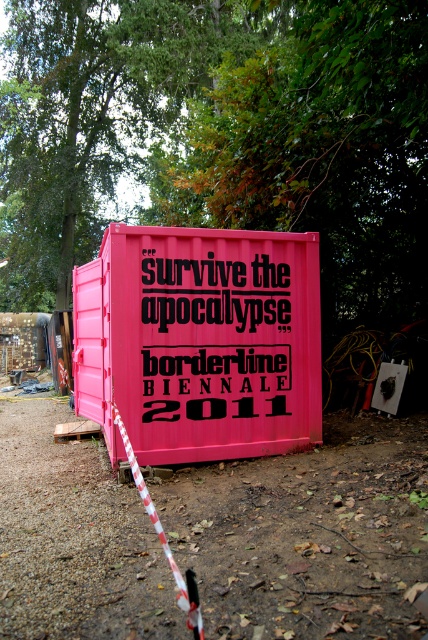
Question: Which point appears farthest from the camera in this image?

Choices:
 (A) pos(267,452)
 (B) pos(151,314)

Answer: (A)

Question: Is pink plastic shipping container at center closer to the viewer compared to blackmaterial/texturetext at center?

Choices:
 (A) yes
 (B) no

Answer: (B)

Question: Considering the relative positions of pink plastic shipping container at center and blackmaterial/texturetext at center in the image provided, where is pink plastic shipping container at center located with respect to blackmaterial/texturetext at center?

Choices:
 (A) left
 (B) right

Answer: (A)

Question: Which of the following is the closest to the observer?

Choices:
 (A) pink plastic shipping container at center
 (B) blackmaterial/texturetext at center

Answer: (B)

Question: Is pink plastic shipping container at center further to camera compared to blackmaterial/texturetext at center?

Choices:
 (A) yes
 (B) no

Answer: (A)

Question: Among these objects, which one is farthest from the camera?

Choices:
 (A) pink plastic shipping container at center
 (B) blackmaterial/texturetext at center

Answer: (A)